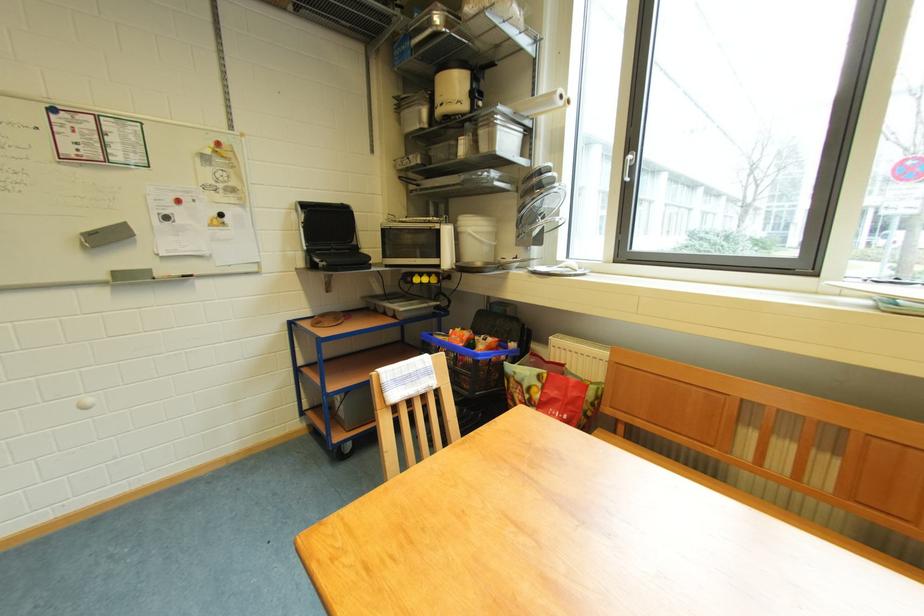
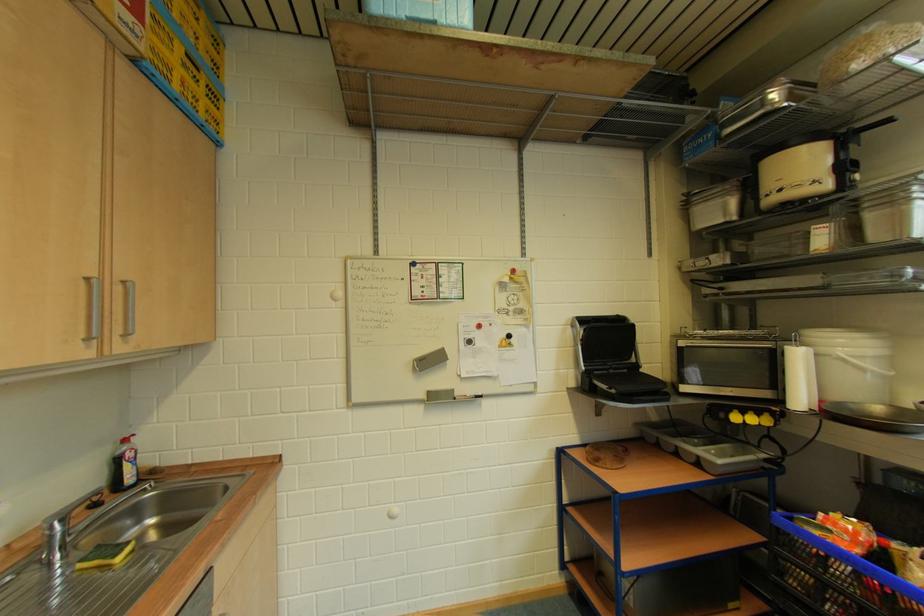
The point at (481, 235) is marked in the first image. Where is the corresponding point in the second image?

(858, 360)